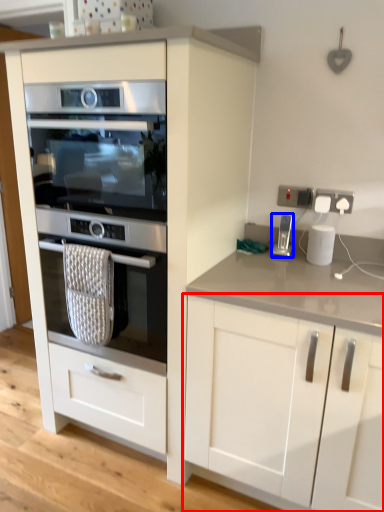
Question: Which point is closer to the camera, cabinetry (highlighted by a red box) or home appliance (highlighted by a blue box)?

Choices:
 (A) cabinetry
 (B) home appliance

Answer: (A)